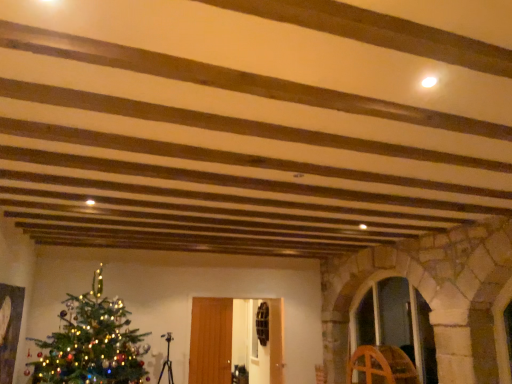
Question: From the image's perspective, is green matte christmas tree at lower left located above or below transparent glass door at center-right, which appears as the first glass door when viewed from the right?

Choices:
 (A) above
 (B) below

Answer: (A)

Question: Does point (113, 334) appear closer or farther from the camera than point (408, 337)?

Choices:
 (A) farther
 (B) closer

Answer: (B)

Question: Which object is the closest to the transparent glass door at center, acting as the second glass door starting from the right?

Choices:
 (A) wooden wheel at right
 (B) transparent glass door at center-right, which appears as the first glass door when viewed from the right
 (C) green matte christmas tree at lower left

Answer: (C)

Question: Which is nearer to the wooden wheel at right?

Choices:
 (A) green matte christmas tree at lower left
 (B) transparent glass door at center, the first glass door viewed from the left
 (C) transparent glass door at center-right, acting as the 2th glass door starting from the left

Answer: (C)